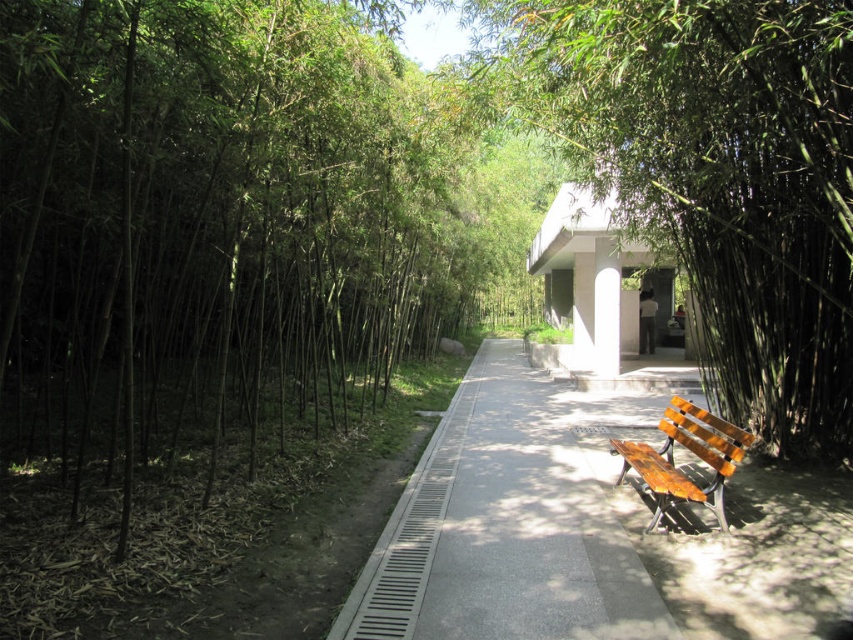
Question: Does green matte bench at center have a larger size compared to wooden bench at lower right?

Choices:
 (A) yes
 (B) no

Answer: (A)

Question: Estimate the real-world distances between objects in this image. Which object is farther from the green matte bench at center?

Choices:
 (A) smooth concrete pavement at center
 (B) wooden bench at lower right

Answer: (A)

Question: Which point appears farthest from the camera in this image?

Choices:
 (A) (695, 490)
 (B) (825, 609)

Answer: (A)

Question: Is green matte bench at center bigger than smooth concrete pavement at center?

Choices:
 (A) no
 (B) yes

Answer: (B)

Question: Which point is farther from the camera taking this photo?

Choices:
 (A) (775, 625)
 (B) (689, 20)
 (C) (722, 518)

Answer: (C)

Question: Can you confirm if green matte bench at center is bigger than smooth concrete pavement at center?

Choices:
 (A) yes
 (B) no

Answer: (A)